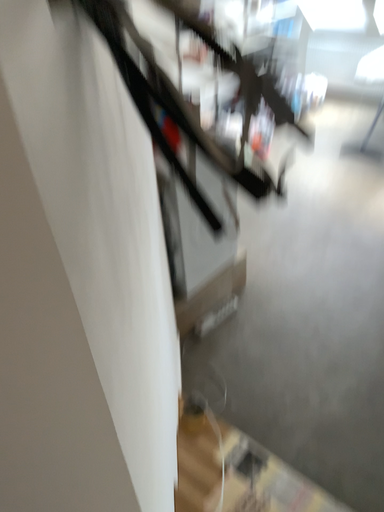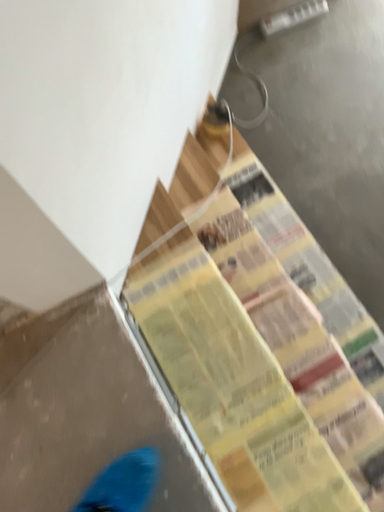
Question: How did the camera likely rotate when shooting the video?

Choices:
 (A) rotated downward
 (B) rotated upward

Answer: (A)